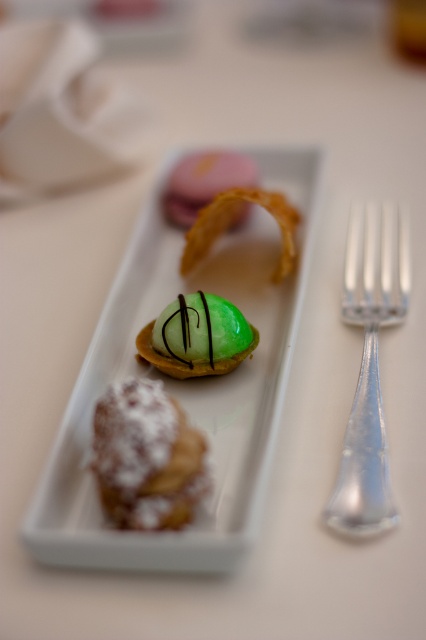
Between powdered sugar pastry at lower left and golden crispy ring at center, which one is positioned lower?

Positioned lower is powdered sugar pastry at lower left.

Which is behind, point (172, 467) or point (187, 250)?

Point (187, 250)

Is point (150, 449) in front of point (258, 202)?

Yes, point (150, 449) is closer to viewer.

Locate an element on the screen. powdered sugar pastry at lower left is located at coordinates (146, 458).

Between point (255, 344) and point (281, 259), which one is positioned behind?

Positioned behind is point (281, 259).

Does green glossy tartlet at center lie in front of golden crispy ring at center?

Yes, green glossy tartlet at center is closer to the viewer.

Looking at this image, who is more distant from viewer, (149, 344) or (224, 204)?

The point (224, 204) is more distant.

Where is `green glossy tartlet at center`? green glossy tartlet at center is located at coordinates (196, 337).

Does green glossy dome at center have a lesser width compared to powdered sugar pastry at lower left?

Incorrect, green glossy dome at center's width is not less than powdered sugar pastry at lower left's.

Which is behind, point (229, 246) or point (127, 468)?

The point (229, 246) is behind.

Is point (126, 308) positioned after point (101, 401)?

Yes, it is behind point (101, 401).

You are a GUI agent. You are given a task and a screenshot of the screen. Output one action in this format:
    pyautogui.click(x=<x>, y=<y>)
    Task: Click on the green glossy dome at center
    The image size is (426, 640).
    Given the screenshot: What is the action you would take?
    pyautogui.click(x=184, y=385)